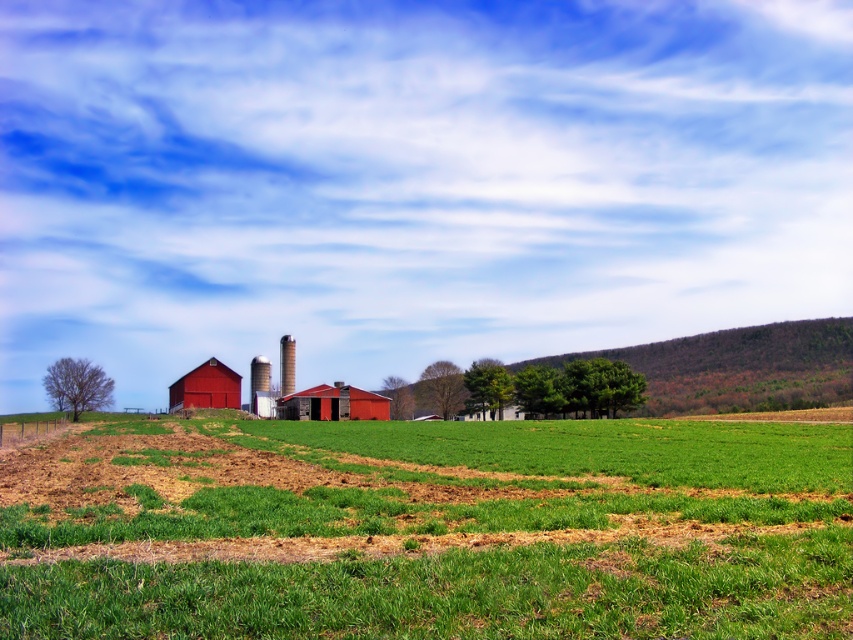
Question: Among these objects, which one is nearest to the camera?

Choices:
 (A) smooth white silo at center
 (B) green leafy hillside at center
 (C) rustic metal silo at center

Answer: (B)

Question: Is green grassy field at center above rustic metal silo at center?

Choices:
 (A) yes
 (B) no

Answer: (B)

Question: Which object appears farthest from the camera in this image?

Choices:
 (A) matte red barn at left
 (B) green grassy field at center
 (C) matte red barn at center

Answer: (A)

Question: Is green leafy hillside at center behind matte red barn at center?

Choices:
 (A) no
 (B) yes

Answer: (A)

Question: Does green grassy field at center appear on the left side of rustic metal silo at center?

Choices:
 (A) no
 (B) yes

Answer: (A)

Question: Which object is closer to the camera taking this photo?

Choices:
 (A) smooth white silo at center
 (B) matte red barn at left
 (C) green grassy field at center
 (D) green leafy hillside at center

Answer: (C)